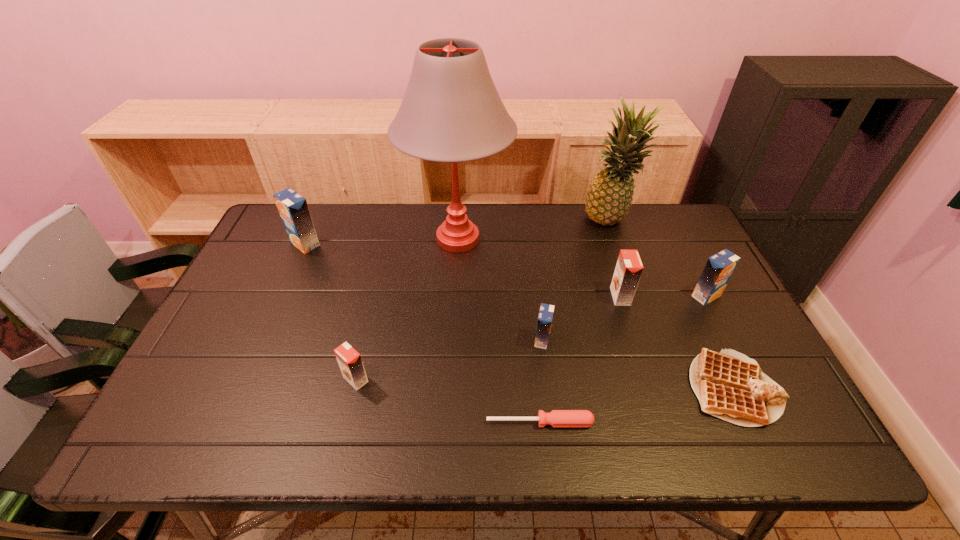
The width and height of the screenshot is (960, 540). In order to click on vacant space at the near left corner of the desktop in this screenshot , I will do `click(175, 438)`.

The image size is (960, 540). Identify the location of free spot between the fourth nearest object and the nearer orange orange juice. (449, 360).

At what (x,y) coordinates should I click in order to perform the action: click on free space that is in between the screwdriver and the second shortest object. Please return your answer as a coordinate pair (x, y). Looking at the image, I should click on (637, 405).

You are a GUI agent. You are given a task and a screenshot of the screen. Output one action in this format:
    pyautogui.click(x=<x>, y=<y>)
    Task: Click on the empty space between the pineapple and the right orange orange juice
    
    Given the screenshot: What is the action you would take?
    pyautogui.click(x=615, y=259)

What are the coordinates of `free space that is in between the shortest object and the second nearest blue orange_juice` in the screenshot? It's located at (623, 359).

Where is `empty space between the second orange juice from right to left and the green pineapple`? empty space between the second orange juice from right to left and the green pineapple is located at coordinates (615, 259).

Locate an element on the screen. free space between the nearer orange orange juice and the tallest object is located at coordinates (407, 309).

Identify the location of vacant space in between the second shortest object and the second smallest blue orange_juice. The image size is (960, 540). (720, 342).

Locate an element on the screen. The image size is (960, 540). free spot between the left orange orange juice and the tallest orange juice is located at coordinates (330, 312).

The height and width of the screenshot is (540, 960). I want to click on empty space that is in between the table lamp and the pineapple, so click(x=534, y=230).